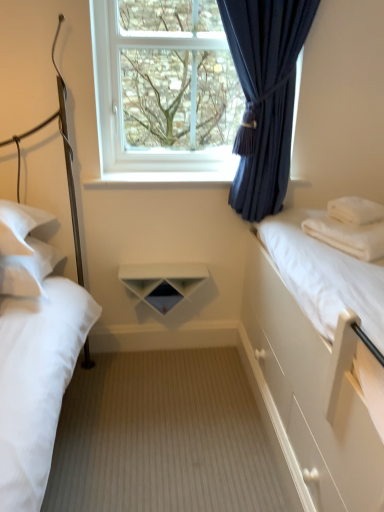
Where is `free region under white matte shelf at center (from a real-world perspective)`? This screenshot has height=512, width=384. free region under white matte shelf at center (from a real-world perspective) is located at coordinates (169, 354).